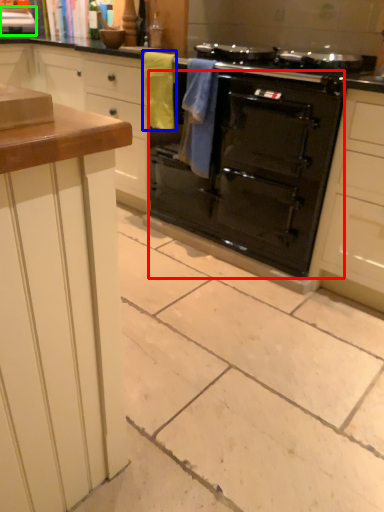
Question: Which object is positioned closest to oven (highlighted by a red box)? Select from material (highlighted by a blue box) and appliance (highlighted by a green box).

Choices:
 (A) material
 (B) appliance

Answer: (A)